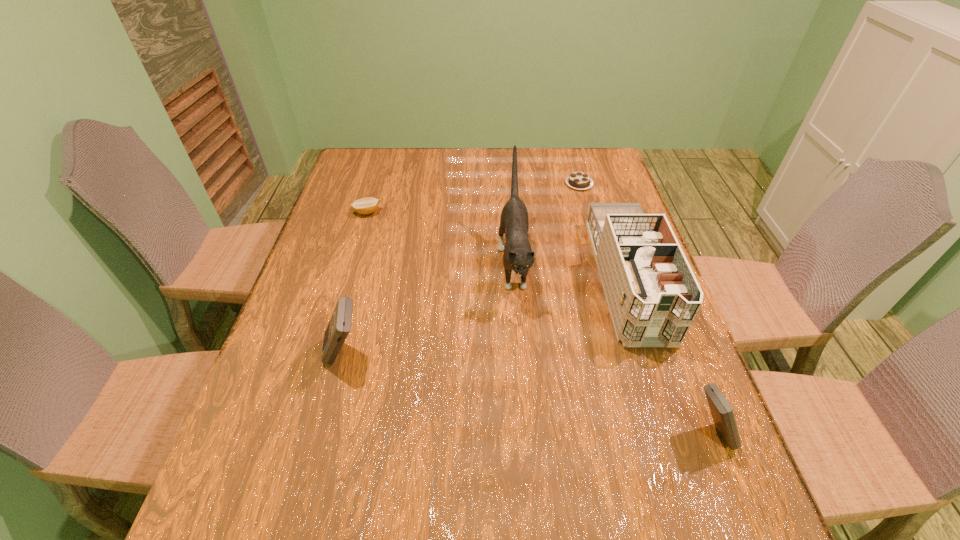
This screenshot has width=960, height=540. I want to click on lemon at the left edge, so click(368, 205).

This screenshot has height=540, width=960. Identify the location of calculator that is positioned at the right edge. (722, 413).

What are the coordinates of `chocolate cake positioned at the right edge` in the screenshot? It's located at (578, 180).

This screenshot has width=960, height=540. In order to click on dollhouse that is at the right edge in this screenshot , I will do pos(653,296).

Where is `object that is at the far right corner`? The height and width of the screenshot is (540, 960). object that is at the far right corner is located at coordinates (578, 180).

This screenshot has width=960, height=540. What are the coordinates of `object situated at the near right corner` in the screenshot? It's located at (722, 413).

The height and width of the screenshot is (540, 960). What are the coordinates of `free space at the far edge` in the screenshot? It's located at (533, 152).

Locate an element on the screen. free spot at the near edge of the desktop is located at coordinates tap(418, 440).

This screenshot has height=540, width=960. I want to click on vacant space at the right edge of the desktop, so click(x=684, y=364).

Identify the location of vacant space at the far left corner of the desktop. (364, 178).